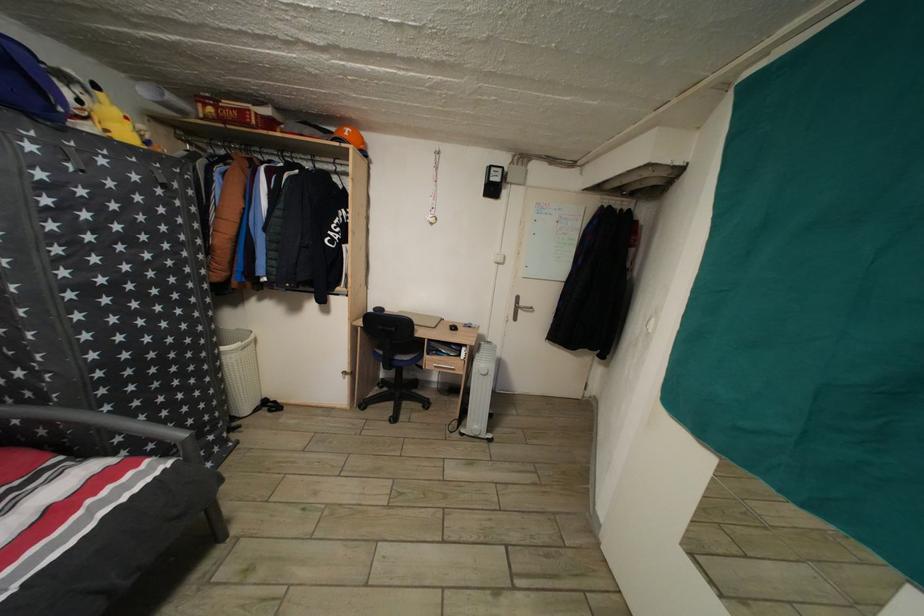
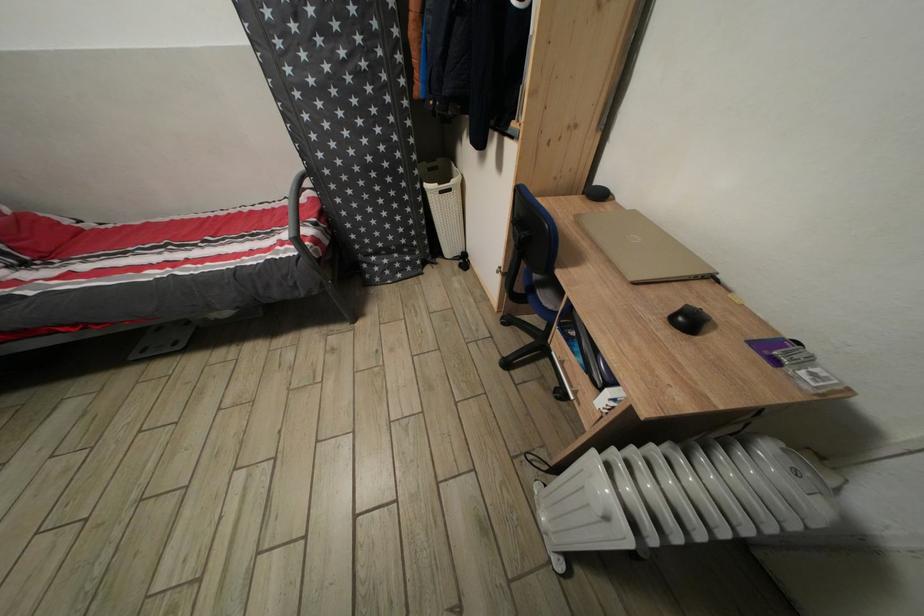
In the second image, find the point that corresponds to (138,394) in the first image.

(357, 198)